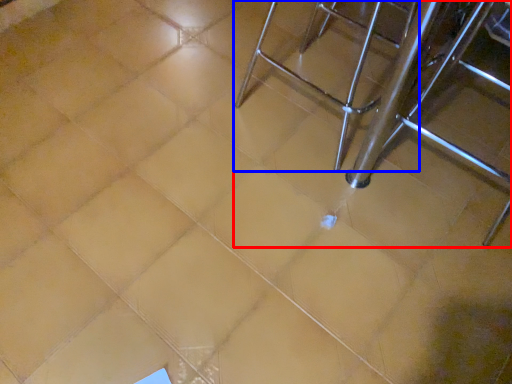
Question: Which object appears farthest to the camera in this image, furniture (highlighted by a red box) or chair (highlighted by a blue box)?

Choices:
 (A) furniture
 (B) chair

Answer: (B)